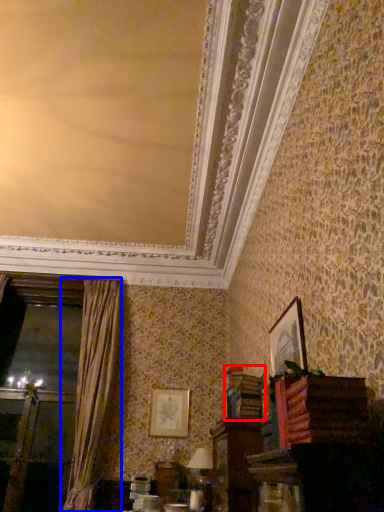
Question: Which point is closer to the camera, book (highlighted by a red box) or curtain (highlighted by a blue box)?

Choices:
 (A) book
 (B) curtain

Answer: (A)